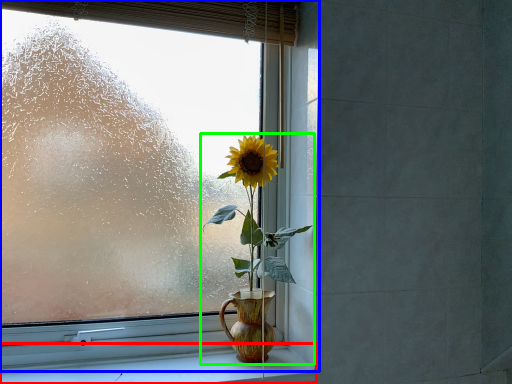
Question: Which is farther away from window sill (highlighted by a red box)? window (highlighted by a blue box) or houseplant (highlighted by a green box)?

Choices:
 (A) window
 (B) houseplant

Answer: (A)